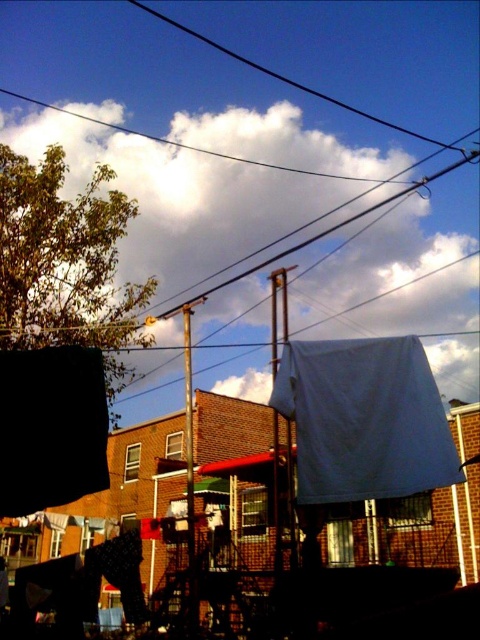
Question: Is white fabric at center positioned in front of black matte canopy at lower left?

Choices:
 (A) no
 (B) yes

Answer: (A)

Question: Among these objects, which one is nearest to the camera?

Choices:
 (A) white fabric at upper center
 (B) white fabric at center
 (C) black wire at upper center
 (D) black matte canopy at lower left

Answer: (D)

Question: Is white fabric at upper center behind black wire at upper center?

Choices:
 (A) yes
 (B) no

Answer: (B)

Question: Is black matte canopy at lower left behind black wire at upper center?

Choices:
 (A) no
 (B) yes

Answer: (A)

Question: Estimate the real-world distances between objects in this image. Which object is farther from the black wire at upper center?

Choices:
 (A) black matte canopy at lower left
 (B) white fabric at center

Answer: (A)

Question: Which is farther from the black matte canopy at lower left?

Choices:
 (A) black wire at upper center
 (B) white fabric at center

Answer: (A)